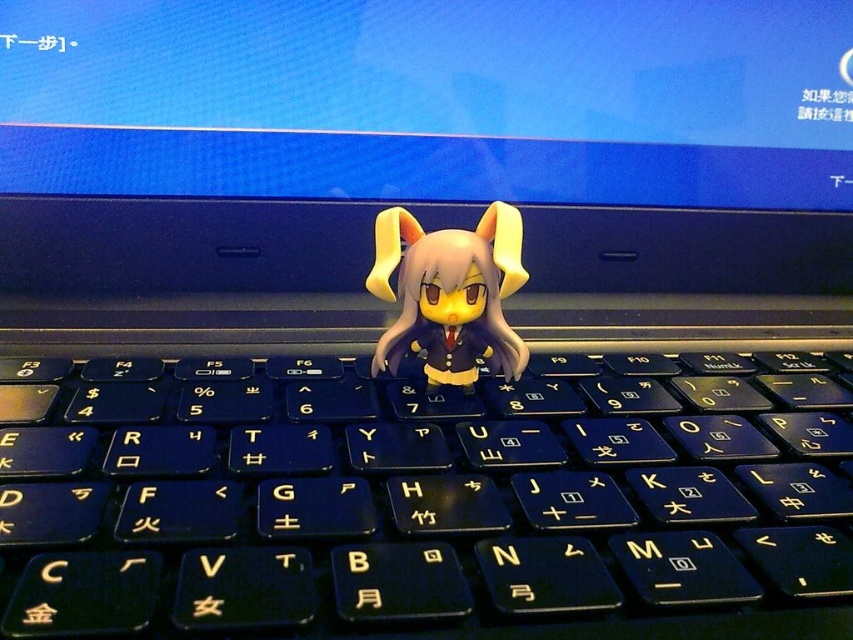
Question: Can you confirm if black plastic keyboard at center is positioned to the right of matte yellow plastic toy at center?

Choices:
 (A) no
 (B) yes

Answer: (B)

Question: Is black plastic keyboard at center in front of matte yellow plastic toy at center?

Choices:
 (A) no
 (B) yes

Answer: (B)

Question: Which point is farther from the camera taking this photo?

Choices:
 (A) (488, 211)
 (B) (172, 400)

Answer: (B)

Question: Is black plastic keyboard at center to the right of matte yellow plastic toy at center from the viewer's perspective?

Choices:
 (A) no
 (B) yes

Answer: (B)

Question: Which of the following is the farthest from the observer?

Choices:
 (A) black plastic keyboard at center
 (B) matte yellow plastic toy at center

Answer: (B)